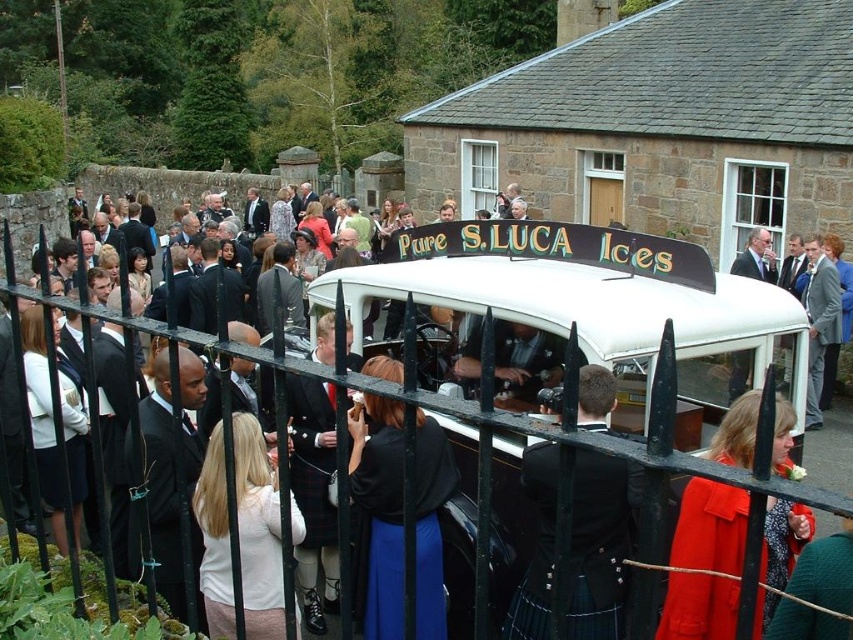
From the picture: Who is positioned more to the left, black metal fence at center or black suit at center?

Positioned to the left is black metal fence at center.

Find the location of a particular element. black metal fence at center is located at coordinates (596, 305).

Between point (682, 612) and point (827, 280), which one is positioned behind?

Point (827, 280)

Locate an element on the screen. The height and width of the screenshot is (640, 853). red wool coat at center is located at coordinates (711, 528).

Find the location of a particular element. The height and width of the screenshot is (640, 853). red wool coat at center is located at coordinates (711, 528).

Is black suit at center smaller than light blue suit at center?

Incorrect, black suit at center is not smaller in size than light blue suit at center.

Does black suit at center appear on the right side of light blue suit at center?

In fact, black suit at center is to the left of light blue suit at center.

Does point (202, 621) come farther from viewer compared to point (830, 323)?

That is False.

The width and height of the screenshot is (853, 640). In order to click on black suit at center in this screenshot , I will do `click(161, 486)`.